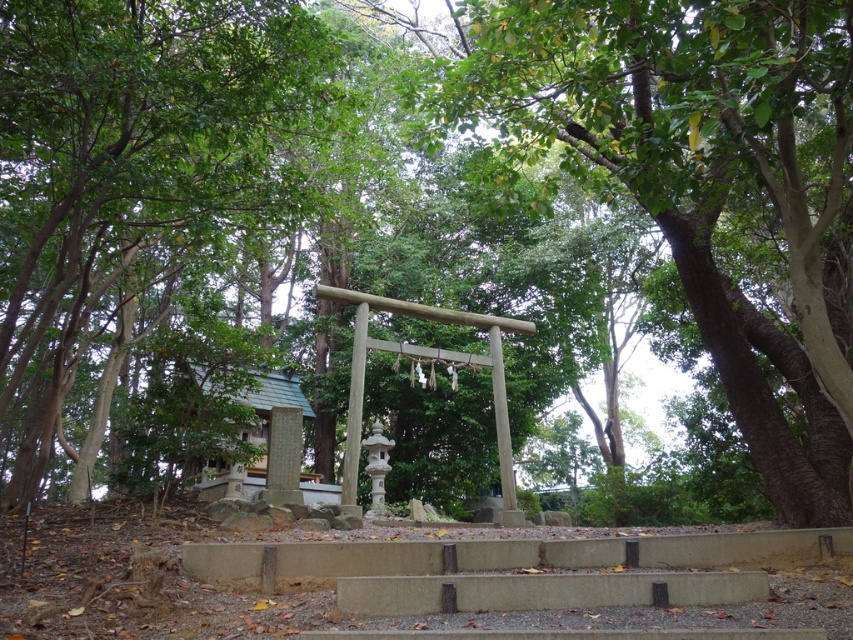
Question: Does green leafy tree at center appear on the right side of green leafy tree at left?

Choices:
 (A) no
 (B) yes

Answer: (B)

Question: Considering the relative positions of green leafy tree at center and green leafy tree at left in the image provided, where is green leafy tree at center located with respect to green leafy tree at left?

Choices:
 (A) left
 (B) right

Answer: (B)

Question: Which point appears farthest from the camera in this image?

Choices:
 (A) (97, 388)
 (B) (524, 74)

Answer: (A)

Question: Is green leafy tree at center closer to camera compared to green leafy tree at left?

Choices:
 (A) yes
 (B) no

Answer: (A)

Question: Which point appears closest to the camera in this image?

Choices:
 (A) (65, 163)
 (B) (709, 109)

Answer: (B)